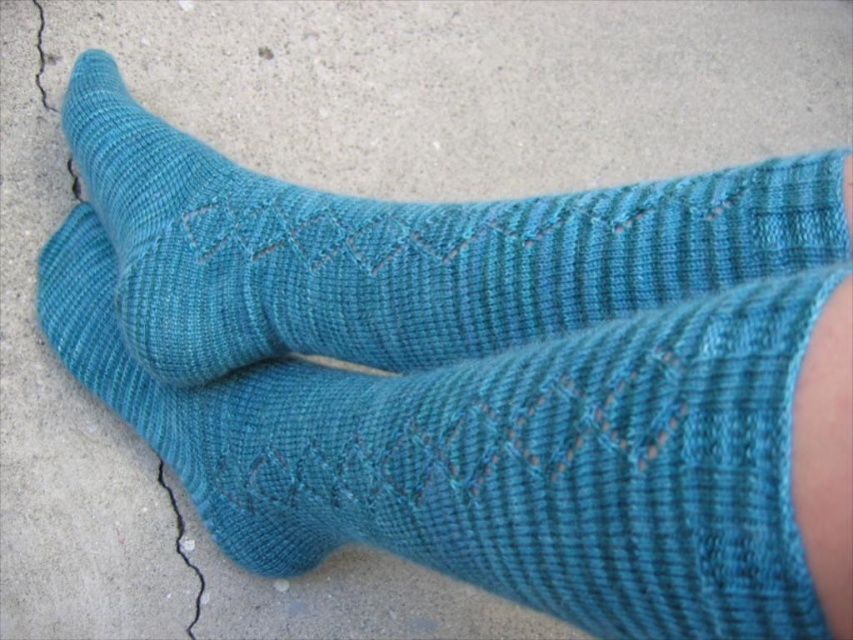
Question: Which point is closer to the camera?

Choices:
 (A) teal knitted sock at center
 (B) teal knitted socks at center

Answer: (B)

Question: Where is teal knitted socks at center located in relation to teal knitted sock at center in the image?

Choices:
 (A) right
 (B) left

Answer: (A)

Question: Which point is farther from the camera taking this photo?

Choices:
 (A) (432, 330)
 (B) (743, 387)

Answer: (A)

Question: Is teal knitted socks at center wider than teal knitted sock at center?

Choices:
 (A) no
 (B) yes

Answer: (B)

Question: Observing the image, what is the correct spatial positioning of teal knitted socks at center in reference to teal knitted sock at center?

Choices:
 (A) right
 (B) left

Answer: (A)

Question: Which object appears closest to the camera in this image?

Choices:
 (A) teal knitted sock at center
 (B) teal knitted socks at center

Answer: (B)